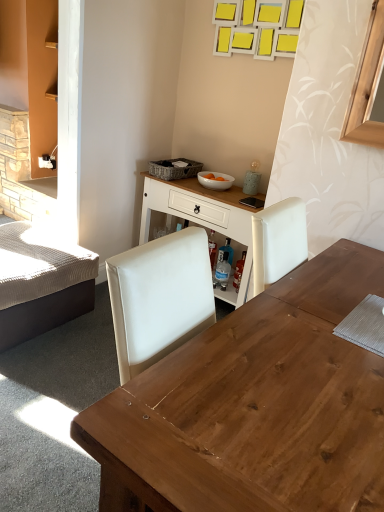
The width and height of the screenshot is (384, 512). What are the coordinates of `free space above wooden desk at center (from a real-world perspective)` in the screenshot? It's located at (322, 351).